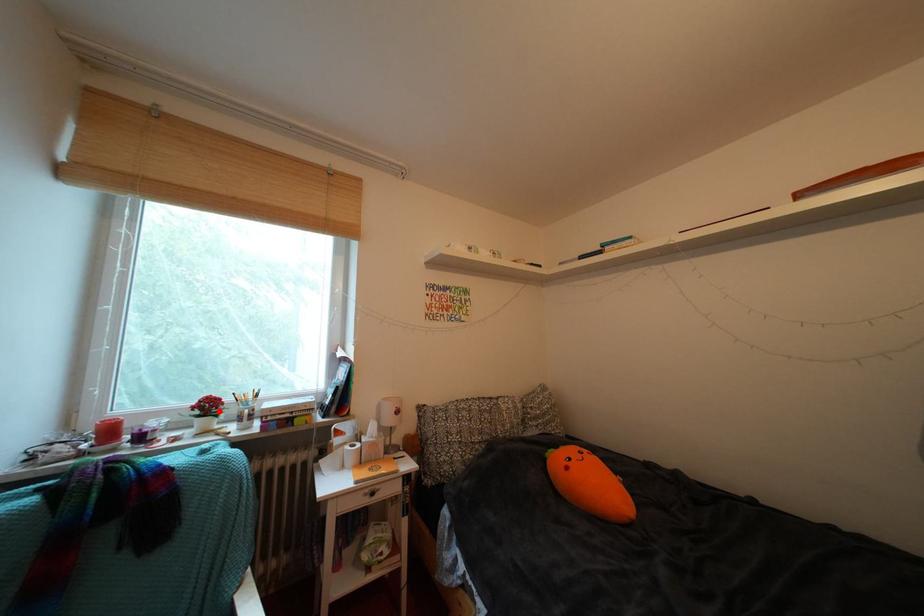
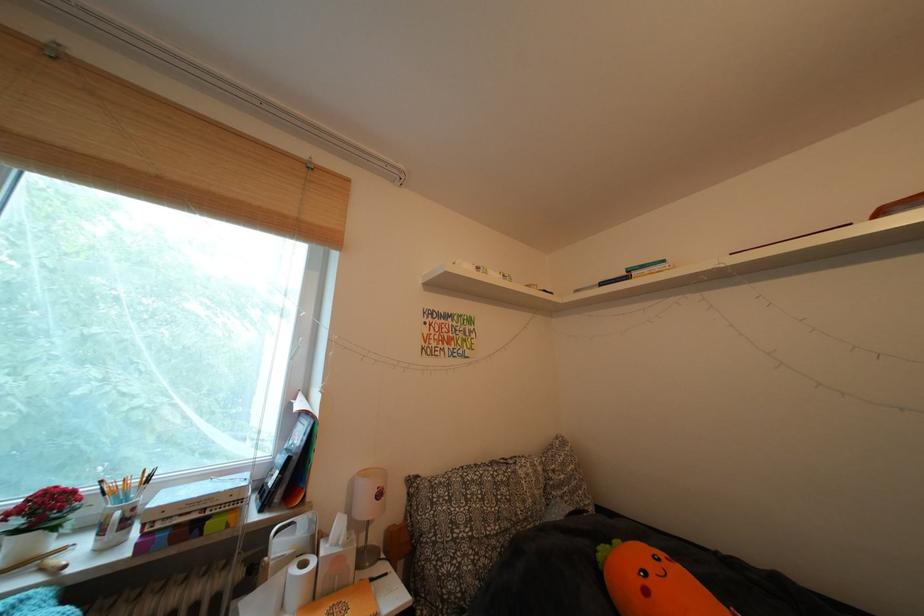
In the second image, find the point that corresponds to the highlighted location in the first image.

(56, 513)